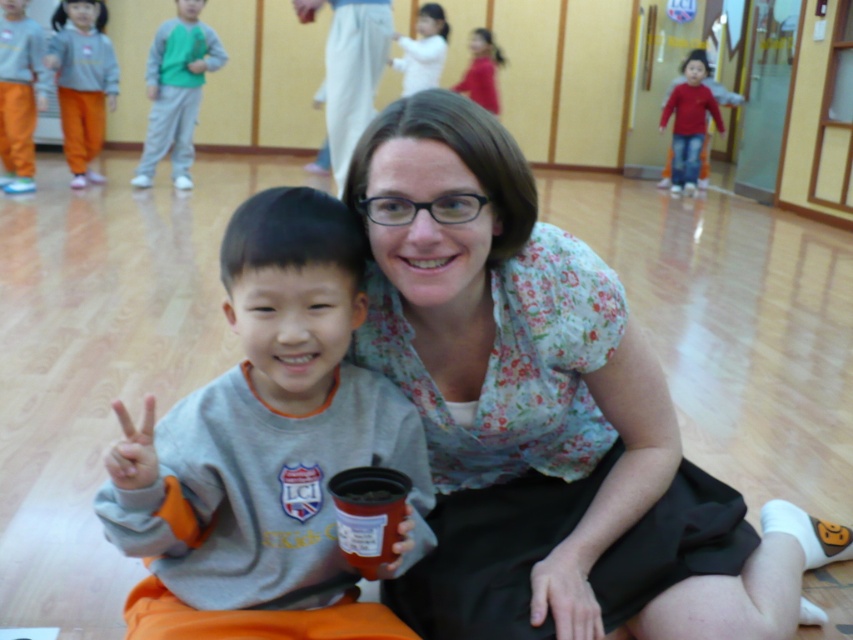
Question: Among these objects, which one is farthest from the camera?

Choices:
 (A) white matte shirt at upper center
 (B) orange sweatpants at left
 (C) orange cotton pants at left
 (D) red cotton sweater at upper right

Answer: (D)

Question: Which point appears farthest from the camera in this image?

Choices:
 (A) (189, 93)
 (B) (596, 330)
 (C) (428, 49)

Answer: (C)

Question: In this image, where is floral fabric blouse at center located relative to orange cotton pants at left?

Choices:
 (A) right
 (B) left

Answer: (A)

Question: Which of the following is the closest to the observer?

Choices:
 (A) floral fabric blouse at center
 (B) orange sweatpants at left
 (C) red cotton sweater at upper right

Answer: (A)

Question: Can you confirm if orange cotton pants at left is positioned to the right of white matte shirt at upper center?

Choices:
 (A) yes
 (B) no

Answer: (B)

Question: Is orange cotton pants at left in front of white matte shirt at upper center?

Choices:
 (A) no
 (B) yes

Answer: (B)